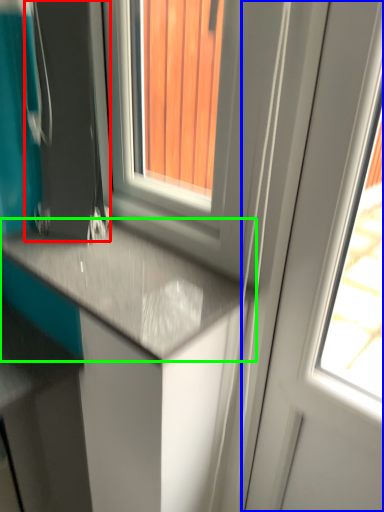
Question: Which object is the farthest from appliance (highlighted by a red box)? Choose among these: screen door (highlighted by a blue box) or countertop (highlighted by a green box).

Choices:
 (A) screen door
 (B) countertop

Answer: (A)